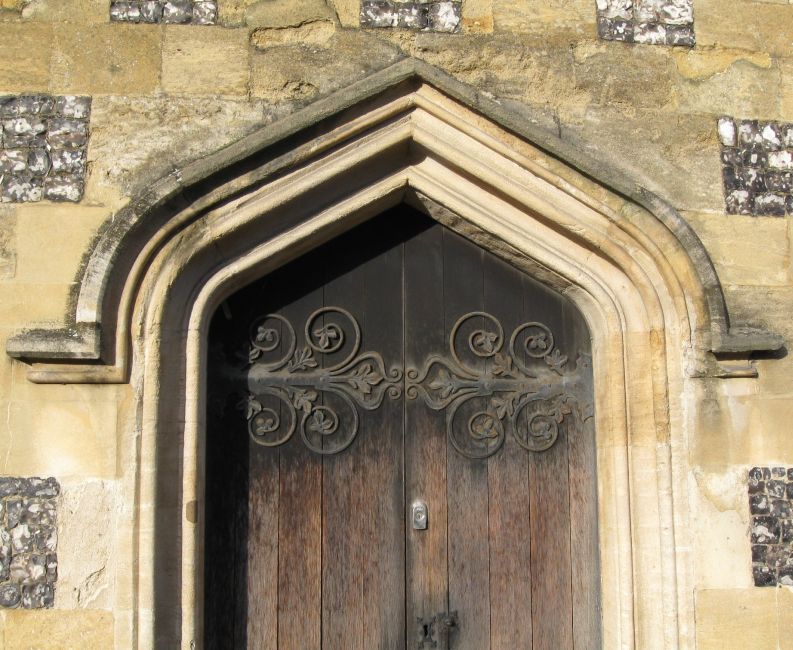
The image size is (793, 650). Identify the location of silver blocks in the wall. (17, 530), (36, 168), (173, 5), (778, 510), (757, 153), (637, 14), (416, 10).